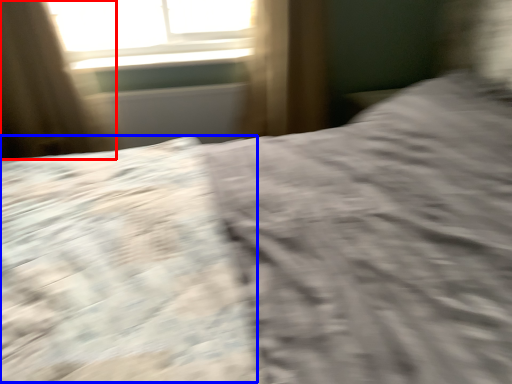
Question: Which object is further to the camera taking this photo, curtain (highlighted by a red box) or sheet (highlighted by a blue box)?

Choices:
 (A) curtain
 (B) sheet

Answer: (A)